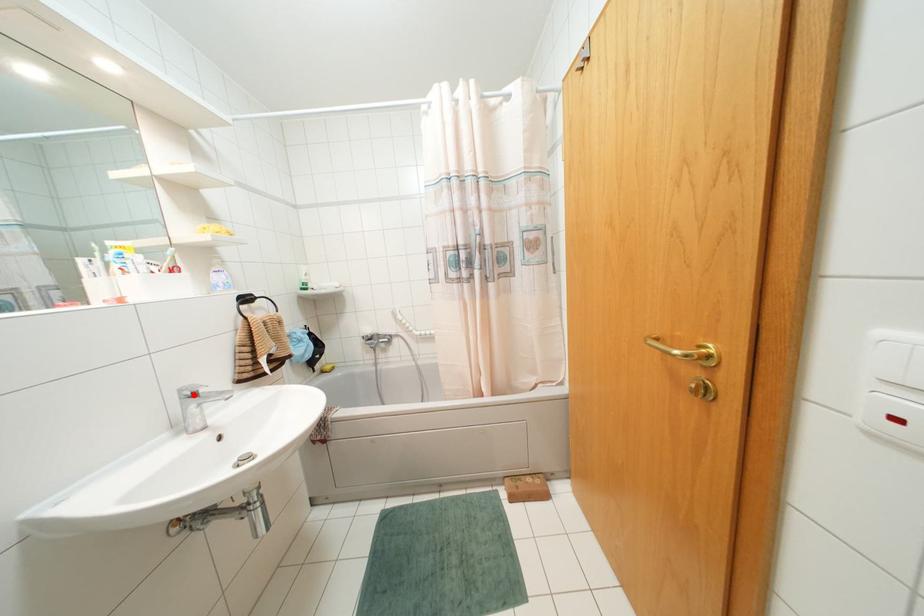
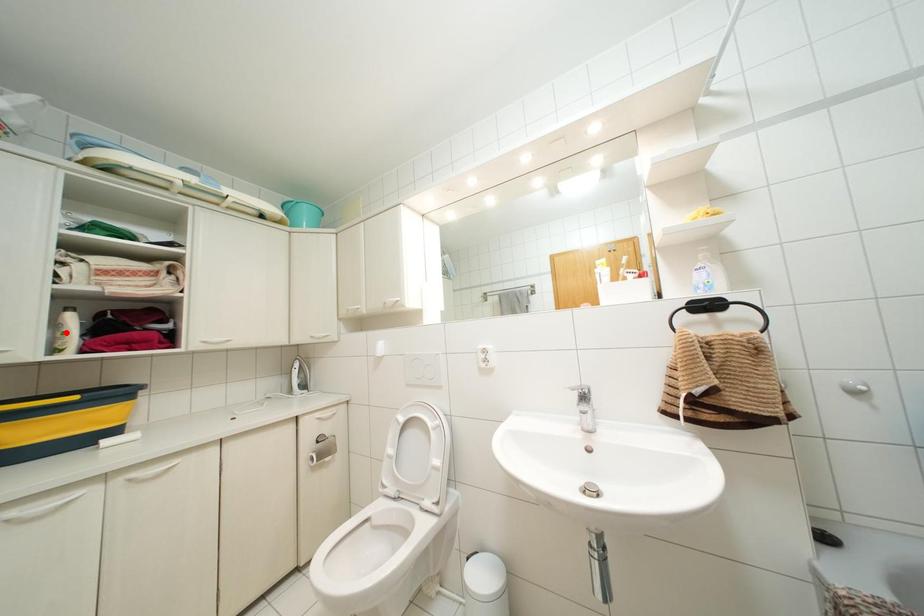
I am providing you with two images of the same scene from different viewpoints. A red point is marked on the first image and another point is marked on the second image. Are the points marked in image1 and image2 representing the same 3D position?

No